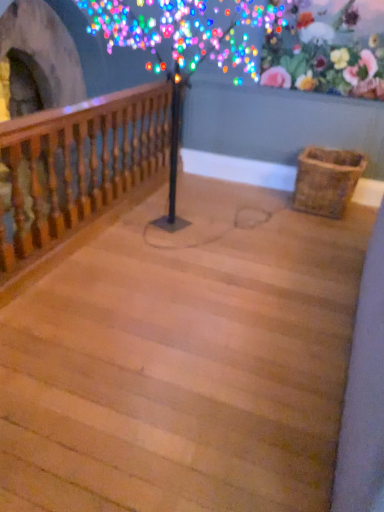
Where is `vacant space to the left of woven brown basket at lower right`? vacant space to the left of woven brown basket at lower right is located at coordinates 260,203.